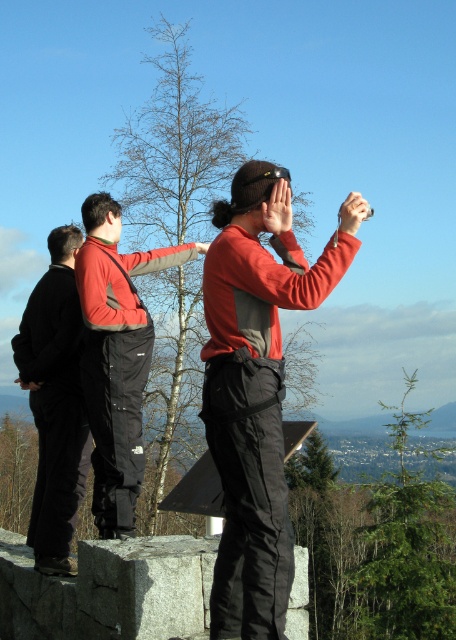
Can you confirm if matte red jacket at center is taller than red fleece jacket at center?

Yes, matte red jacket at center is taller than red fleece jacket at center.

Does matte red jacket at center come in front of red fleece jacket at center?

That is True.

Identify the location of matte red jacket at center. The width and height of the screenshot is (456, 640). (257, 387).

Which is below, matte red jacket at center or black softshell jacket at left?

Positioned lower is black softshell jacket at left.

How much distance is there between matte red jacket at center and black softshell jacket at left?

matte red jacket at center is 2.18 meters away from black softshell jacket at left.

Locate an element on the screen. Image resolution: width=456 pixels, height=640 pixels. matte red jacket at center is located at coordinates (257, 387).

Where is `matte red jacket at center`? This screenshot has height=640, width=456. matte red jacket at center is located at coordinates (257, 387).

How much distance is there between red fleece jacket at center and black softshell jacket at left?

red fleece jacket at center is 20.30 inches away from black softshell jacket at left.

Is point (100, 330) positioned behind point (24, 316)?

No, (100, 330) is closer to viewer.

Between point (125, 440) and point (31, 404), which one is positioned behind?

Positioned behind is point (31, 404).

Where is `red fleece jacket at center`? This screenshot has width=456, height=640. red fleece jacket at center is located at coordinates (115, 356).